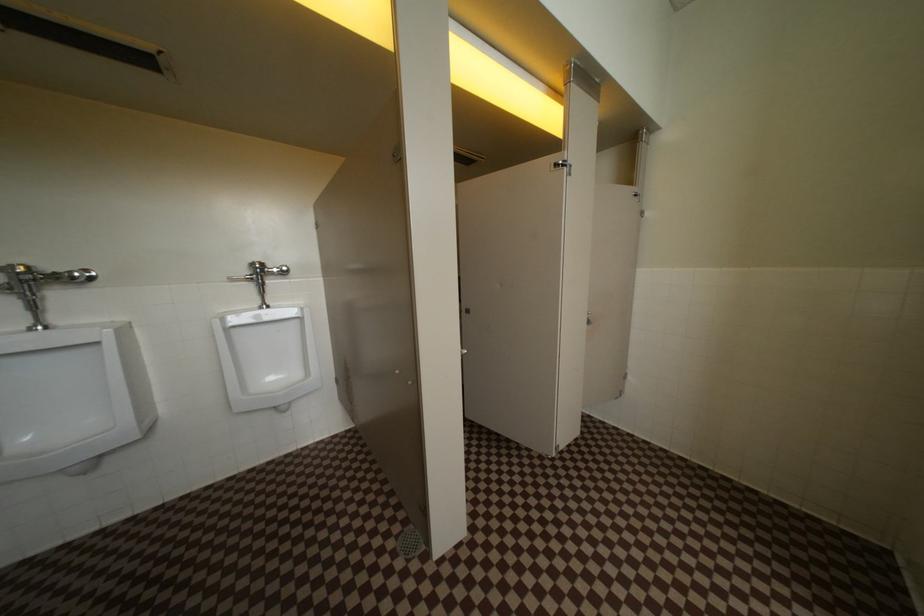
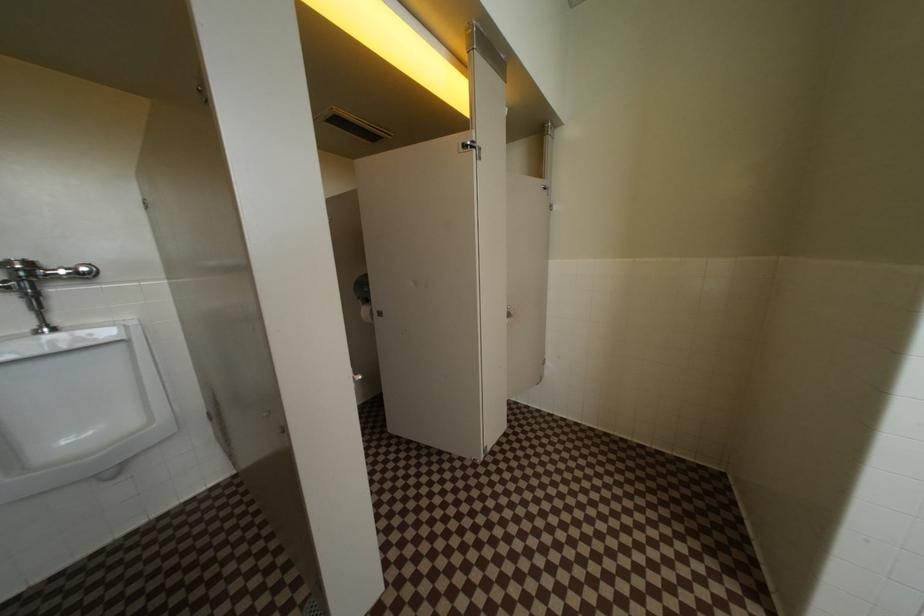
The images are taken continuously from a first-person perspective. In which direction are you moving?

The cameraman moved toward right, forward.